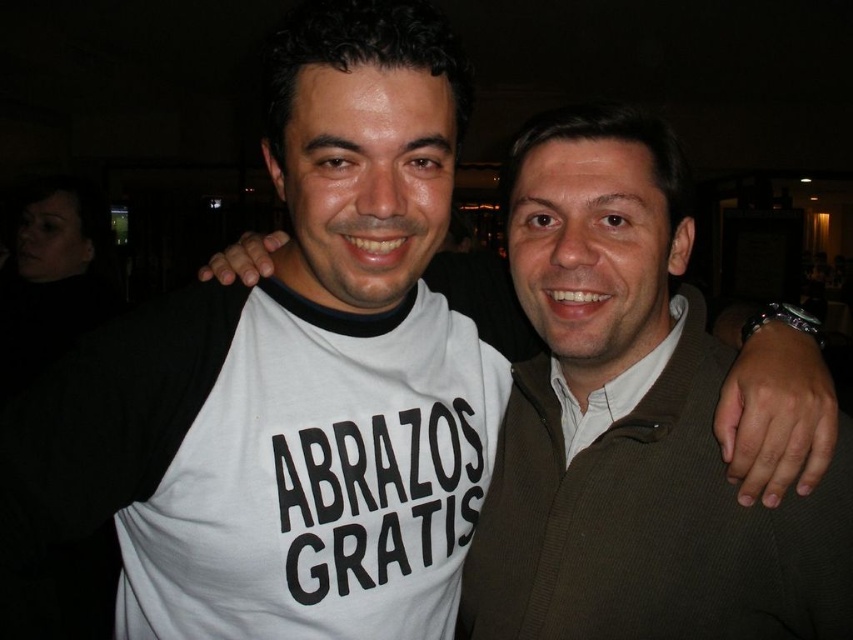
Can you confirm if white cotton shirt at center is taller than matte brown shirt at center?

Yes.

Is white cotton shirt at center to the left of matte brown shirt at center from the viewer's perspective?

Indeed, white cotton shirt at center is positioned on the left side of matte brown shirt at center.

Is point (672, 515) farther from viewer compared to point (567, 406)?

That is False.

Image resolution: width=853 pixels, height=640 pixels. What are the coordinates of `white cotton shirt at center` in the screenshot? It's located at (648, 525).